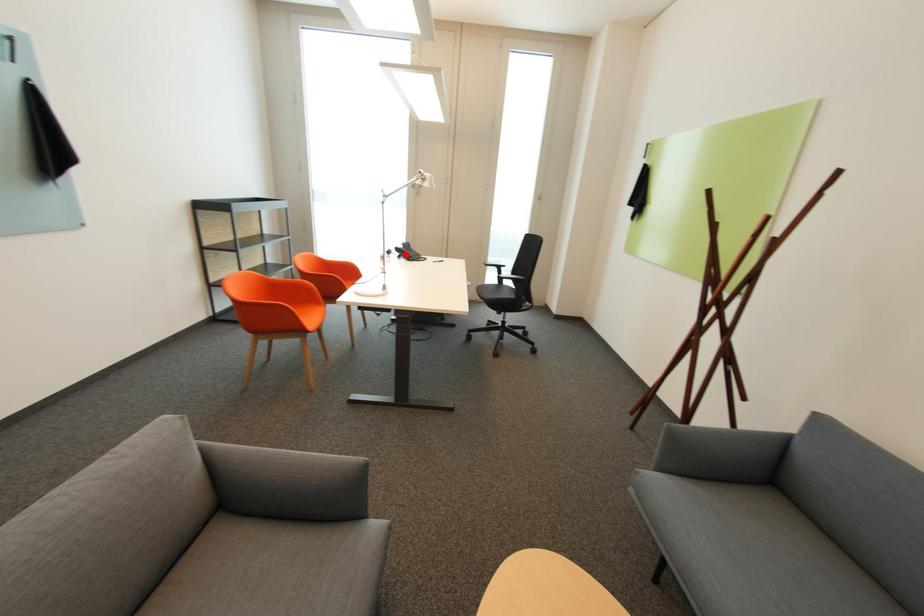
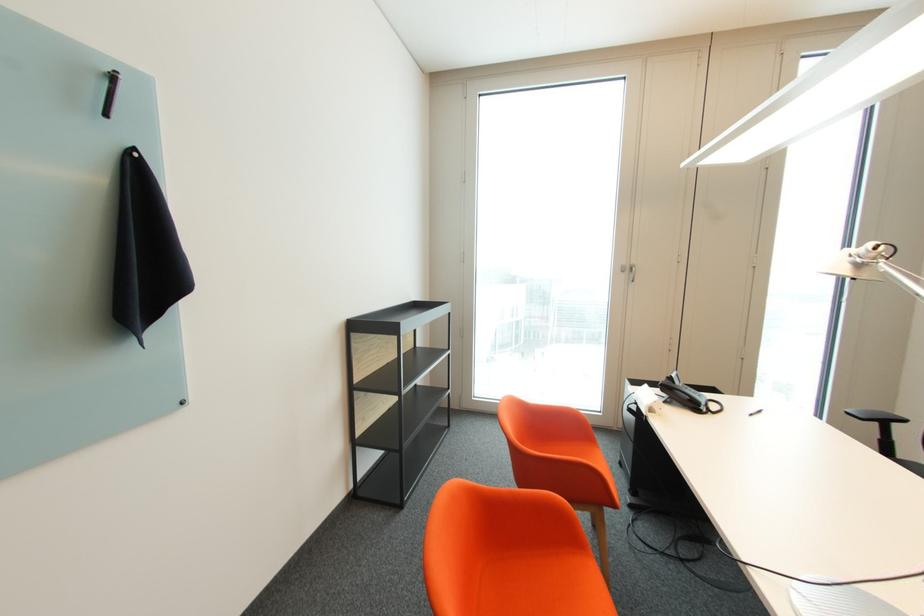
The point at the highlighted location is marked in the first image. Where is the corresponding point in the second image?

(673, 397)